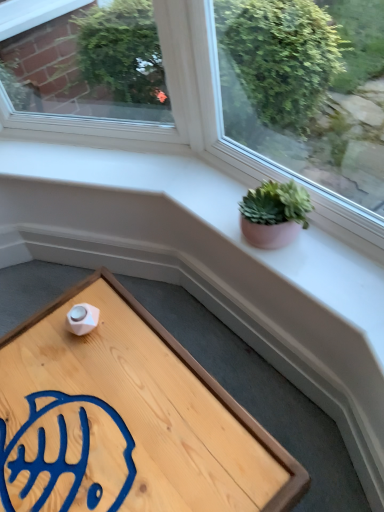
At what (x,y) coordinates should I click in order to perform the action: click on free spot behind green succulent in clay pot at upper right. Please return your answer as a coordinate pair (x, y). The height and width of the screenshot is (512, 384). Looking at the image, I should click on (217, 198).